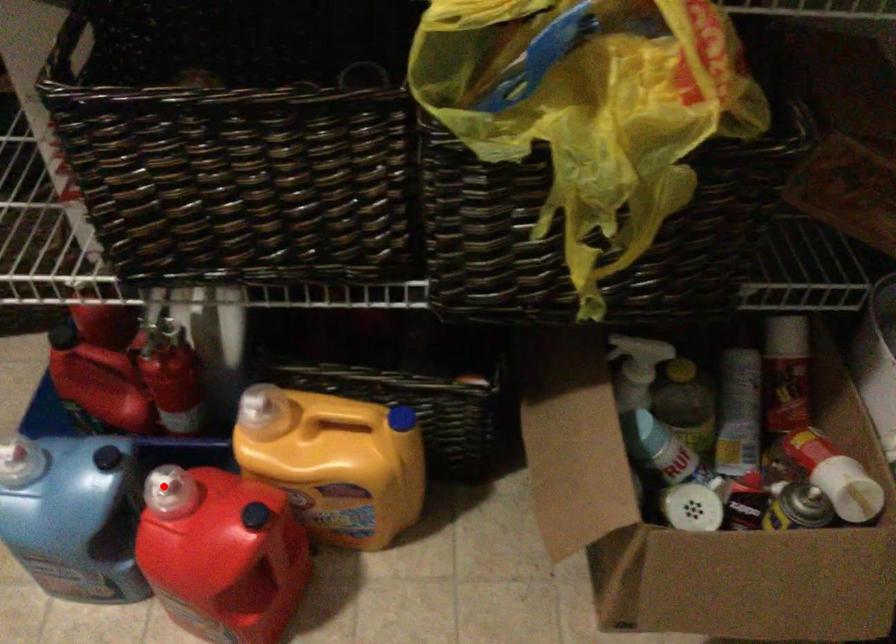
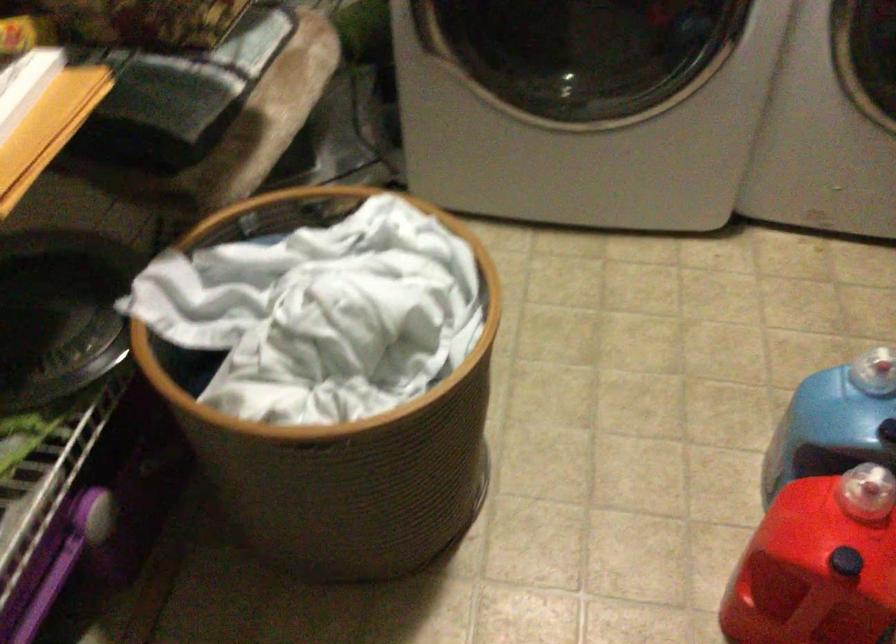
In the second image, find the point that corresponds to the highlighted location in the first image.

(866, 491)